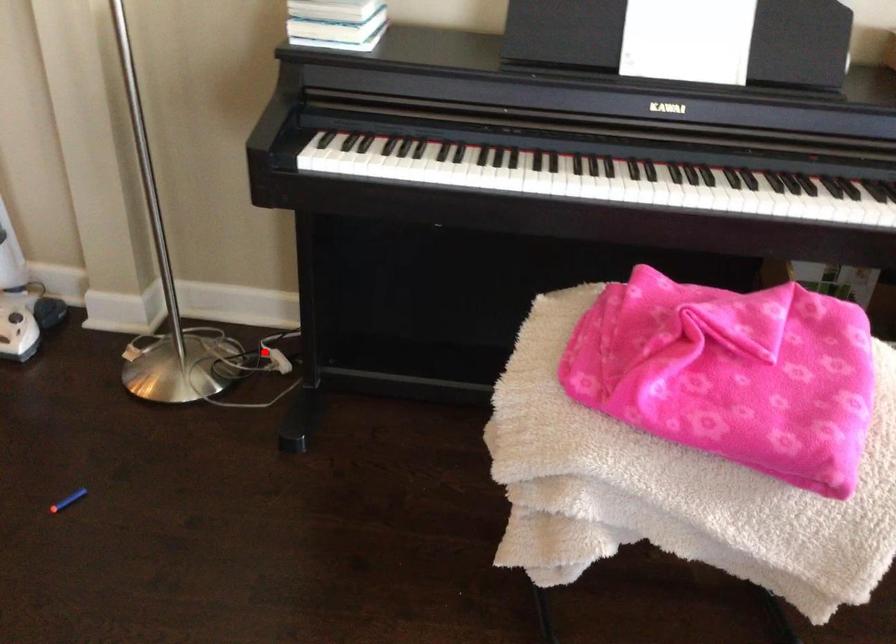
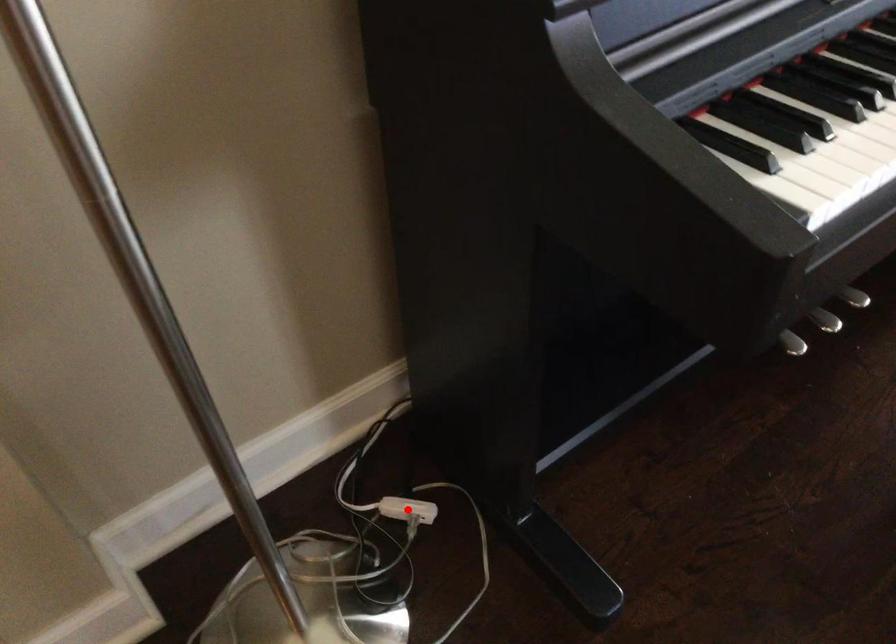
Looking at this image, I am providing you with two images of the same scene from different viewpoints. A red point is marked on the first image and another point is marked on the second image. Is the red point in image1 aligned with the point shown in image2?

Yes